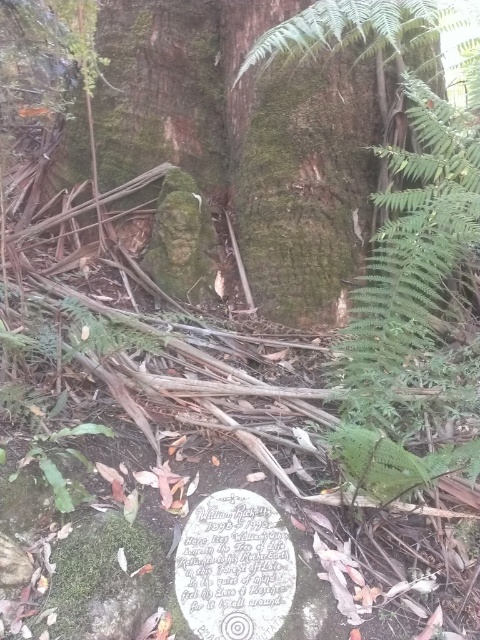
You are a hiker who has found two points marked on a map while navigating through the forest. The first point is labeled as point (100, 160) and the second as point (204, 518). According to the map, which point is farther away from your current position?

Point (100, 160) is behind point (204, 518), so it is farther away from your current position.